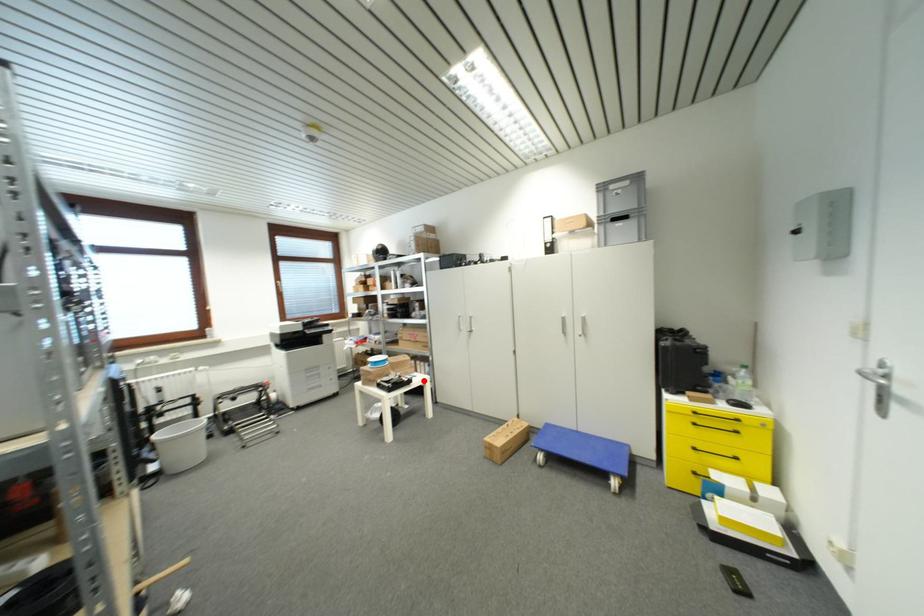
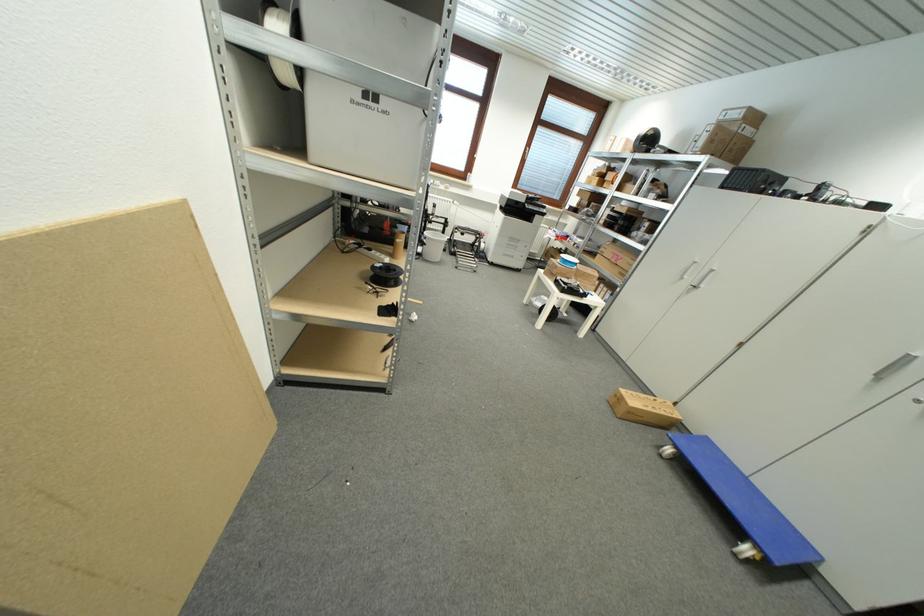
In the second image, find the point that corresponds to the highlighted location in the first image.

(599, 301)